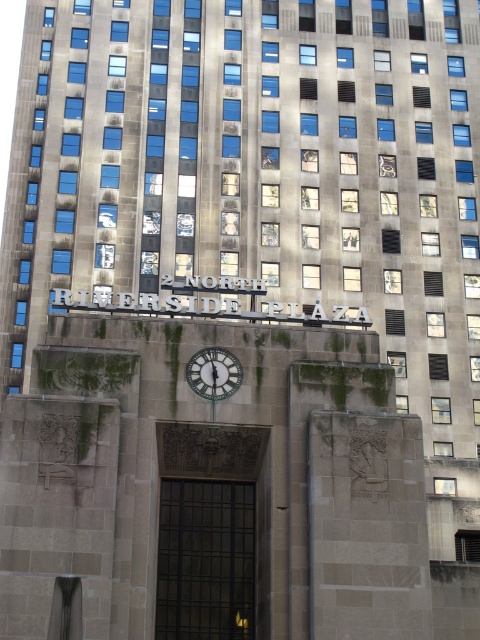
Question: Does dark bronze door at center appear on the left side of metallic silver clock at center?

Choices:
 (A) no
 (B) yes

Answer: (A)

Question: In this image, where is dark bronze door at center located relative to metallic silver clock at center?

Choices:
 (A) below
 (B) above

Answer: (A)

Question: Is dark bronze door at center above metallic silver clock at center?

Choices:
 (A) no
 (B) yes

Answer: (A)

Question: Which of the following is the farthest from the observer?

Choices:
 (A) (218, 540)
 (B) (199, 371)

Answer: (A)